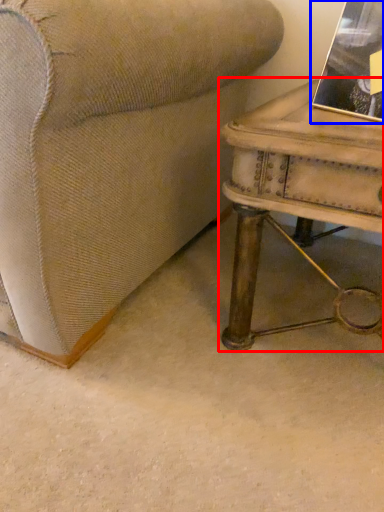
Question: Which of the following is the farthest to the observer, table (highlighted by a red box) or book (highlighted by a blue box)?

Choices:
 (A) table
 (B) book

Answer: (B)